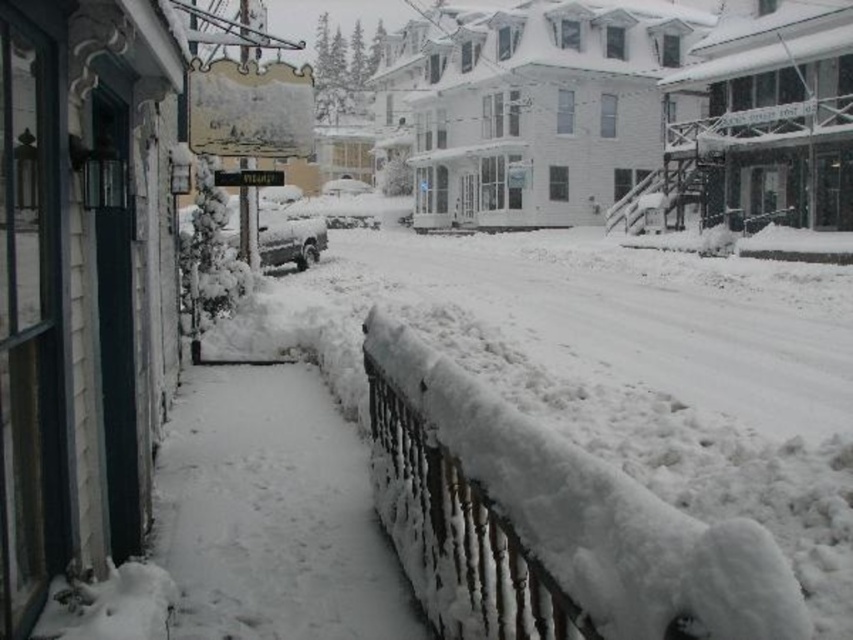
Question: Is snow-covered metal railing at lower center to the left of black metal sign at center from the viewer's perspective?

Choices:
 (A) no
 (B) yes

Answer: (A)

Question: Which point is closer to the camera?

Choices:
 (A) snow-covered metal railing at lower center
 (B) snow-covered van at center
 (C) white snow-covered pavement at lower left

Answer: (A)

Question: Observing the image, what is the correct spatial positioning of snow-covered metal railing at lower center in reference to black metal sign at center?

Choices:
 (A) below
 (B) above

Answer: (A)

Question: Where is white snow-covered pavement at lower left located in relation to snow-covered van at center in the image?

Choices:
 (A) above
 (B) below

Answer: (B)

Question: Which point is closer to the camera?

Choices:
 (A) (286, 256)
 (B) (276, 172)
 (C) (434, 529)

Answer: (C)

Question: Estimate the real-world distances between objects in this image. Which object is farther from the snow-covered van at center?

Choices:
 (A) snow-covered metal railing at lower center
 (B) white snow-covered pavement at lower left

Answer: (B)